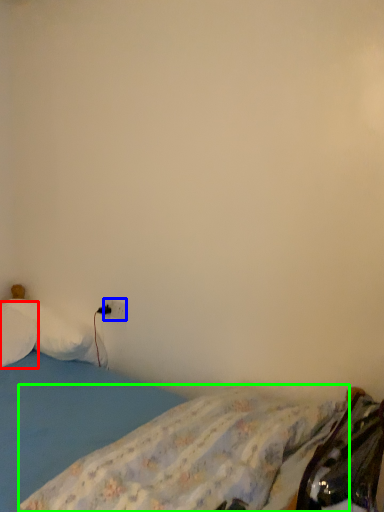
Question: Which object is the farthest from pillow (highlighted by a red box)? Choose among these: electric outlet (highlighted by a blue box) or mattress (highlighted by a green box).

Choices:
 (A) electric outlet
 (B) mattress

Answer: (B)